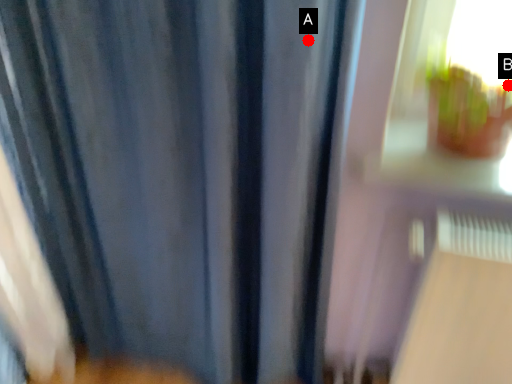
Question: Two points are circled on the image, labeled by A and B beside each circle. Which of the following is the closest to the observer?

Choices:
 (A) A is closer
 (B) B is closer

Answer: (A)